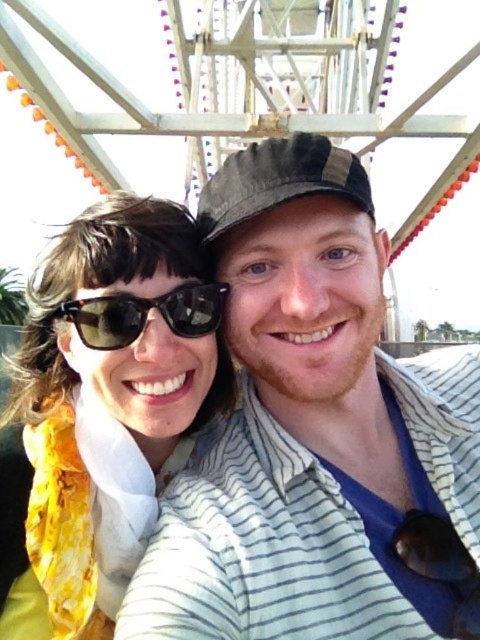
Question: Among these objects, which one is farthest from the camera?

Choices:
 (A) black reflective sunglasses at center
 (B) yellow fabric scarf at left

Answer: (A)

Question: Is yellow fabric scarf at left closer to the viewer compared to black reflective sunglasses at center?

Choices:
 (A) yes
 (B) no

Answer: (A)

Question: Can you confirm if yellow fabric scarf at left is smaller than black reflective sunglasses at center?

Choices:
 (A) yes
 (B) no

Answer: (B)

Question: Observing the image, what is the correct spatial positioning of yellow fabric scarf at left in reference to black reflective sunglasses at center?

Choices:
 (A) above
 (B) below

Answer: (B)